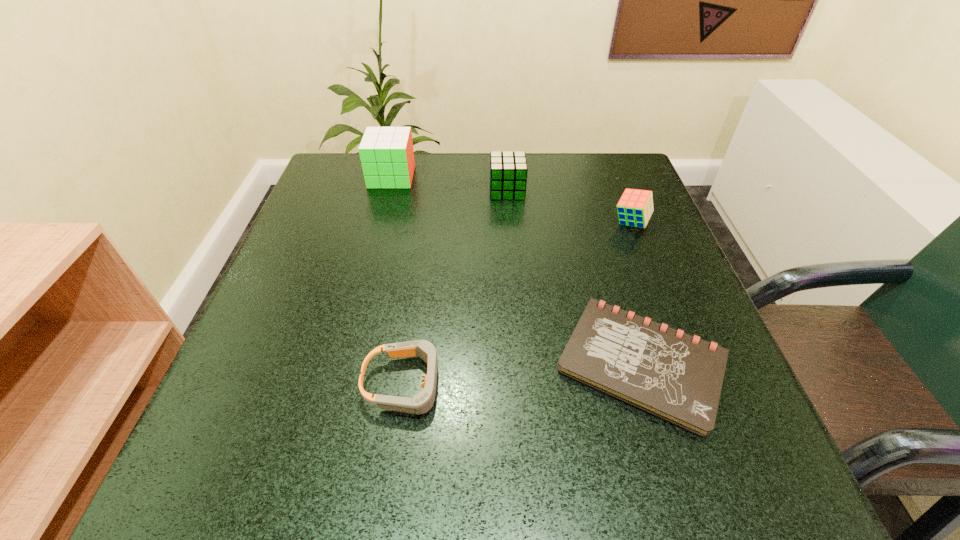
Locate an element on the screen. Image resolution: width=960 pixels, height=540 pixels. unoccupied area between the third object from left to right and the nearest cube is located at coordinates (569, 206).

I want to click on vacant area between the leftmost cube and the shortest object, so click(516, 270).

This screenshot has width=960, height=540. In order to click on vacant space that is in between the rightmost cube and the second cube from left to right in this screenshot , I will do `click(569, 206)`.

This screenshot has width=960, height=540. I want to click on the fourth closest object to the second cube from left to right, so click(x=422, y=402).

Identify the location of the closest object to the tallest cube. (508, 170).

Locate an element on the screen. The image size is (960, 540). cube identified as the second closest to the second cube from left to right is located at coordinates (386, 153).

I want to click on cube object that ranks as the second closest to the leftmost cube, so click(x=635, y=207).

Find the location of `free region that satisfies the following two spatial constraints: 1. on the front side of the shortest object; 2. on the right side of the second cube from right to left`. free region that satisfies the following two spatial constraints: 1. on the front side of the shortest object; 2. on the right side of the second cube from right to left is located at coordinates (520, 363).

Identify the location of free spot that satisfies the following two spatial constraints: 1. on the front side of the tallest object; 2. on the left side of the notebook. (344, 363).

At what (x,y) coordinates should I click in order to perform the action: click on vacant space that satisfies the following two spatial constraints: 1. on the back side of the nearest cube; 2. on the left side of the notebook. Please return your answer as a coordinate pair (x, y). Image resolution: width=960 pixels, height=540 pixels. Looking at the image, I should click on (599, 222).